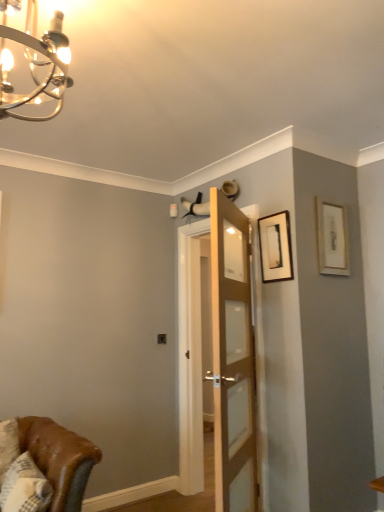
Question: Is matte black picture frame at upper right, acting as the 2th picture frame starting from the right, to the left or to the right of matte gold picture frame at upper right, which ranks as the 2th picture frame in left-to-right order, in the image?

Choices:
 (A) right
 (B) left

Answer: (B)

Question: In terms of height, does matte black picture frame at upper right, acting as the 2th picture frame starting from the right, look taller or shorter compared to matte gold picture frame at upper right, which ranks as the 2th picture frame in left-to-right order?

Choices:
 (A) tall
 (B) short

Answer: (B)

Question: Which object is the farthest from the matte black picture frame at upper right, acting as the 2th picture frame starting from the right?

Choices:
 (A) wooden door at center
 (B) matte gold picture frame at upper right, acting as the first picture frame starting from the right
 (C) chrome/metallic chandelier at upper left
 (D) white textured pillow at lower left

Answer: (D)

Question: Based on their relative distances, which object is nearer to the matte gold picture frame at upper right, which ranks as the 2th picture frame in left-to-right order?

Choices:
 (A) white textured pillow at lower left
 (B) wooden door at center
 (C) matte black picture frame at upper right, acting as the 2th picture frame starting from the right
 (D) chrome/metallic chandelier at upper left

Answer: (C)